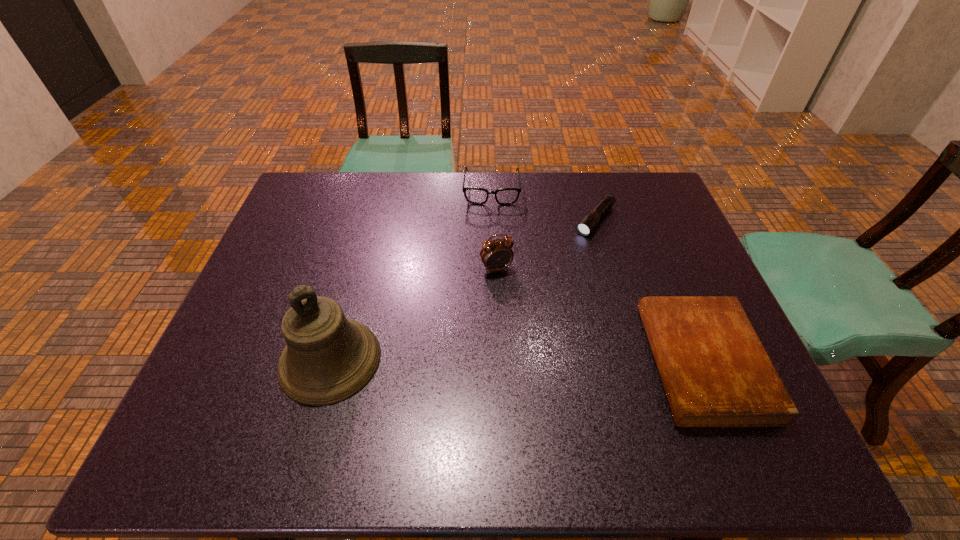
This screenshot has width=960, height=540. Identify the location of vacant space on the desktop that is between the bell and the Bible and is positioned at the lens end of the flashlight. (472, 361).

Where is `free space on the desktop that is between the leftmost object and the Bible and is positioned on the front-facing side of the spectacles`? The image size is (960, 540). free space on the desktop that is between the leftmost object and the Bible and is positioned on the front-facing side of the spectacles is located at coordinates (490, 361).

Locate an element on the screen. The height and width of the screenshot is (540, 960). vacant spot on the desktop that is between the tallest object and the Bible and is positioned on the face of the second tallest object is located at coordinates (546, 362).